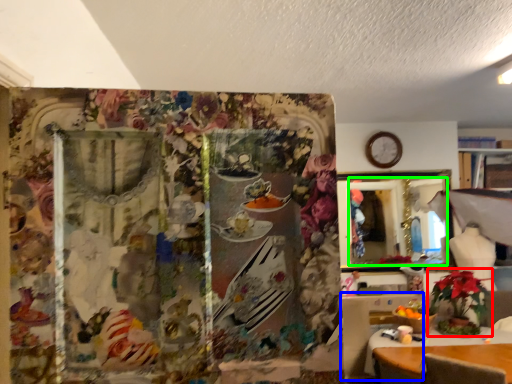
Question: Which object is positioned closest to houseplant (highlighted by a red box)? Select from table (highlighted by a blue box) and mirror (highlighted by a green box).

Choices:
 (A) table
 (B) mirror

Answer: (A)